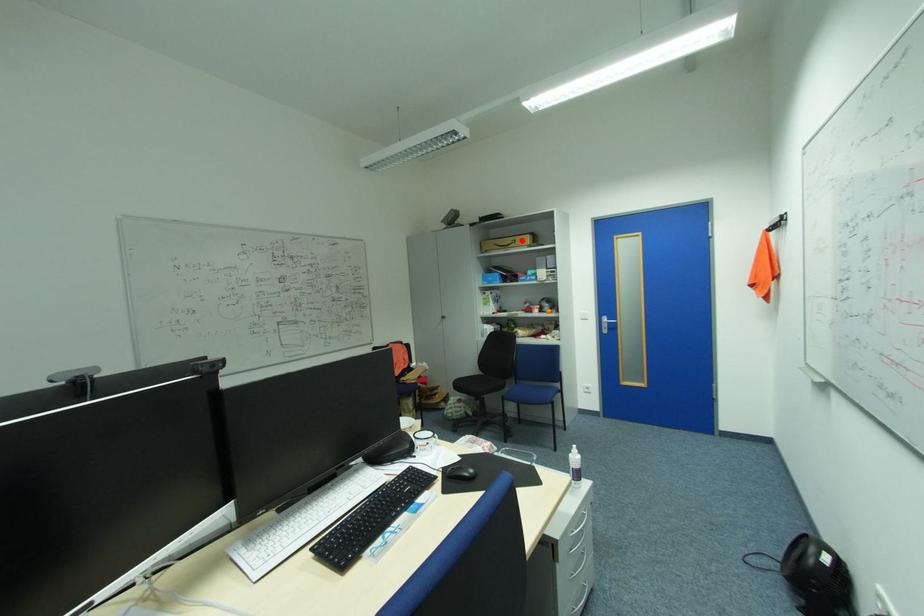
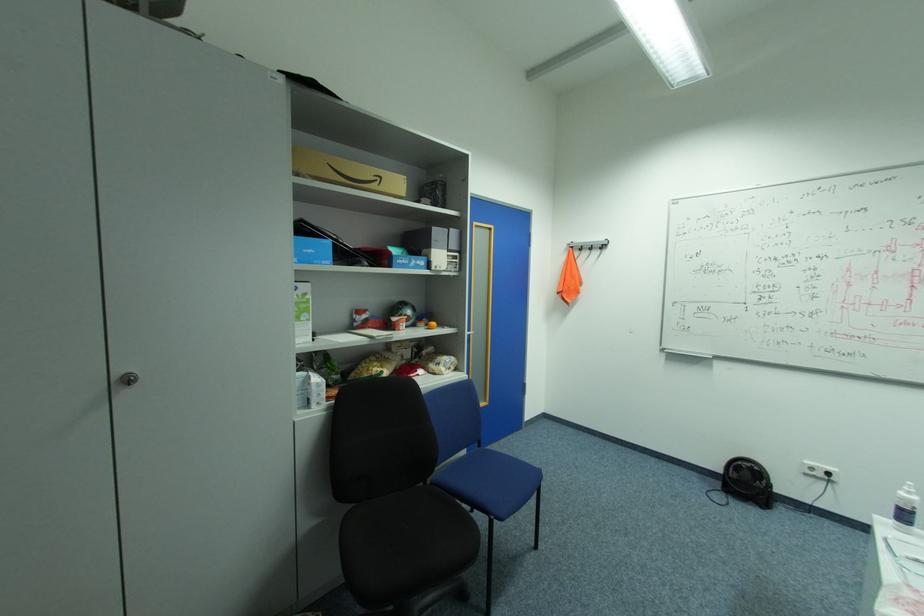
In the second image, find the point that corresponds to the highlighted location in the first image.

(386, 177)